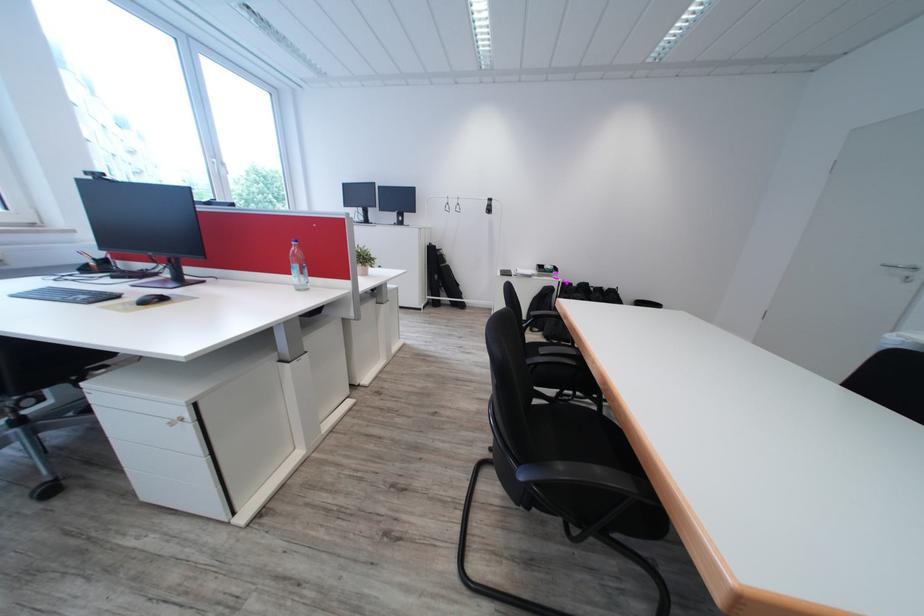
Find where to lift the small potted plant. Please return your answer as a coordinate pair (x, y).

(363, 259)